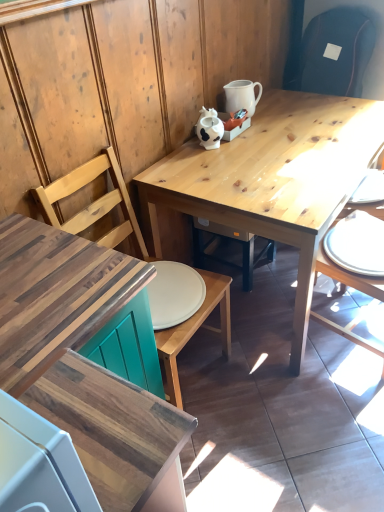
Describe the element at coordinates (357, 244) in the screenshot. I see `white glossy plate at right` at that location.

Describe the element at coordinates (242, 96) in the screenshot. I see `white glossy pitcher at upper center` at that location.

Locate an element on the screen. white matte cow-shaped teapot at upper center is located at coordinates (209, 128).

What do you see at coordinates (348, 277) in the screenshot? The height and width of the screenshot is (512, 384). I see `wooden chair at right, which is the 2th chair in left-to-right order` at bounding box center [348, 277].

Where is `white glossy plate at right`? The width and height of the screenshot is (384, 512). white glossy plate at right is located at coordinates (357, 244).

Does white glossy plate at right appear on the left side of white matte cow-shaped teapot at upper center?

No, white glossy plate at right is not to the left of white matte cow-shaped teapot at upper center.

You are a GUI agent. You are given a task and a screenshot of the screen. Output one action in this format:
    pyautogui.click(x=<x>, y=<y>)
    Task: Click on the tea set behind the white glossy plate at right
    The image size is (384, 512).
    Given the screenshot: What is the action you would take?
    pyautogui.click(x=209, y=128)

Which of these two, white glossy plate at right or white matte cow-shaped teapot at upper center, is thinner?

With smaller width is white matte cow-shaped teapot at upper center.

Between wooden chair at center, acting as the 2th chair starting from the right, and wooden desk at lower left, which one is positioned behind?

wooden chair at center, acting as the 2th chair starting from the right, is behind.

From the image's perspective, which is below, wooden chair at center, acting as the 2th chair starting from the right, or wooden desk at lower left?

From the image's view, wooden desk at lower left is below.

Between wooden chair at center, acting as the 2th chair starting from the right, and wooden desk at lower left, which one has larger width?

Wider between the two is wooden desk at lower left.

Is there a large distance between wooden chair at center, acting as the 2th chair starting from the right, and wooden desk at lower left?

They are positioned close to each other.

Based on the photo, from a real-world perspective, is white matte cow-shaped teapot at upper center above or below wooden chair at center, acting as the 2th chair starting from the right?

In terms of real-world spatial position, white matte cow-shaped teapot at upper center is above wooden chair at center, acting as the 2th chair starting from the right.

Which is further, (203, 132) or (217, 298)?

The point (203, 132) is farther.

From the image's perspective, which object appears higher, white matte cow-shaped teapot at upper center or wooden chair at center, the first chair viewed from the left?

white matte cow-shaped teapot at upper center appears higher in the image.

Which object is closer to the camera taking this photo, white matte cow-shaped teapot at upper center or wooden chair at center, acting as the 2th chair starting from the right?

wooden chair at center, acting as the 2th chair starting from the right, is in front.

Is wooden chair at right, the first chair viewed from the right, inside the boundaries of white matte cow-shaped teapot at upper center, or outside?

wooden chair at right, the first chair viewed from the right, exists outside the volume of white matte cow-shaped teapot at upper center.

Image resolution: width=384 pixels, height=512 pixels. I want to click on chair on the right side of white matte cow-shaped teapot at upper center, so click(348, 277).

Does point (374, 344) come behind point (205, 134)?

Yes, point (374, 344) is farther from viewer.

Is white glossy pitcher at upper center surrounded by wooden desk at lower left?

That's incorrect, white glossy pitcher at upper center is not inside wooden desk at lower left.

Can you see wooden desk at lower left touching white glossy pitcher at upper center?

No.

Between wooden desk at lower left and white glossy pitcher at upper center, which one has larger size?

wooden desk at lower left.

From a real-world perspective, is wooden chair at right, which is the 2th chair in left-to-right order, on top of wooden chair at center, acting as the 2th chair starting from the right?

No.

Between wooden chair at right, which is the 2th chair in left-to-right order, and wooden chair at center, the first chair viewed from the left, which one has larger size?

With larger size is wooden chair at center, the first chair viewed from the left.

Between wooden chair at right, the first chair viewed from the right, and wooden chair at center, the first chair viewed from the left, which one has smaller width?

With smaller width is wooden chair at right, the first chair viewed from the right.

Considering the sizes of wooden chair at right, the first chair viewed from the right, and white glossy plate at right in the image, is wooden chair at right, the first chair viewed from the right, bigger or smaller than white glossy plate at right?

In the image, wooden chair at right, the first chair viewed from the right, appears to be larger than white glossy plate at right.

Is wooden chair at right, the first chair viewed from the right, oriented towards white glossy plate at right?

Yes, wooden chair at right, the first chair viewed from the right, is turned towards white glossy plate at right.

Is wooden chair at right, the first chair viewed from the right, shorter than white glossy plate at right?

In fact, wooden chair at right, the first chair viewed from the right, may be taller than white glossy plate at right.

Does point (333, 268) appear closer or farther from the camera than point (375, 264)?

Clearly, point (333, 268) is more distant from the camera than point (375, 264).

Locate an element on the screen. tea set above the white glossy plate at right (from the image's perspective) is located at coordinates (209, 128).

You are a GUI agent. You are given a task and a screenshot of the screen. Output one action in this format:
    pyautogui.click(x=<x>, y=<y>)
    Task: Click on the chair that is the 1st one below the wooden desk at lower left (from a real-world perspective)
    This screenshot has width=384, height=512.
    Given the screenshot: What is the action you would take?
    pyautogui.click(x=94, y=202)

From the image, which object appears to be nearer to natural wood table at center, wooden desk at lower left or wooden chair at center, acting as the 2th chair starting from the right?

wooden chair at center, acting as the 2th chair starting from the right.

From the image, which object appears to be nearer to white glossy plate at right, white glossy pitcher at upper center or wooden chair at right, the first chair viewed from the right?

Among the two, wooden chair at right, the first chair viewed from the right, is located nearer to white glossy plate at right.

Which object lies further to the anchor point white glossy plate at right, wooden chair at center, acting as the 2th chair starting from the right, or white matte cow-shaped teapot at upper center?

Based on the image, wooden chair at center, acting as the 2th chair starting from the right, appears to be further to white glossy plate at right.

Looking at the image, which one is located further to wooden desk at lower left, white glossy pitcher at upper center or wooden chair at right, the first chair viewed from the right?

The object further to wooden desk at lower left is white glossy pitcher at upper center.

Considering their positions, is white matte cow-shaped teapot at upper center positioned further to wooden desk at lower left than wooden chair at right, the first chair viewed from the right?

white matte cow-shaped teapot at upper center.

Looking at the image, which one is located closer to natural wood table at center, wooden chair at center, the first chair viewed from the left, or white glossy plate at right?

white glossy plate at right is closer to natural wood table at center.

Which object lies further to the anchor point wooden chair at center, the first chair viewed from the left, white glossy plate at right or white matte cow-shaped teapot at upper center?

Based on the image, white glossy plate at right appears to be further to wooden chair at center, the first chair viewed from the left.

From the image, which object appears to be nearer to white matte cow-shaped teapot at upper center, wooden desk at lower left or natural wood table at center?

natural wood table at center is closer to white matte cow-shaped teapot at upper center.

At what (x,y) coordinates should I click in order to perform the action: click on table situated between wooden chair at center, acting as the 2th chair starting from the right, and white glossy plate at right from left to right. Please return your answer as a coordinate pair (x, y). This screenshot has width=384, height=512. Looking at the image, I should click on (275, 179).

Image resolution: width=384 pixels, height=512 pixels. What are the coordinates of `table located between white matte cow-shaped teapot at upper center and wooden chair at right, the first chair viewed from the right, in the left-right direction` in the screenshot? It's located at (275, 179).

Image resolution: width=384 pixels, height=512 pixels. What are the coordinates of `tea set between wooden chair at center, acting as the 2th chair starting from the right, and wooden chair at right, which is the 2th chair in left-to-right order, from left to right` in the screenshot? It's located at (209, 128).

Image resolution: width=384 pixels, height=512 pixels. I want to click on tea set between wooden chair at right, the first chair viewed from the right, and white glossy pitcher at upper center, along the z-axis, so click(209, 128).